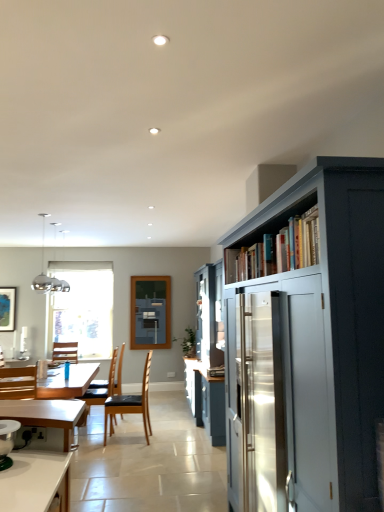
Describe the element at coordinates (276, 245) in the screenshot. This screenshot has height=512, width=384. I see `white painted wood bookshelf at upper right` at that location.

This screenshot has height=512, width=384. What do you see at coordinates (101, 387) in the screenshot?
I see `brown leather chair at lower left, which is the 2th chair from right to left` at bounding box center [101, 387].

Describe the element at coordinates (65, 352) in the screenshot. I see `wooden chair at left, the first chair in the back-to-front sequence` at that location.

Describe the element at coordinates (307, 342) in the screenshot. The width and height of the screenshot is (384, 512). I see `matte gray cupboard at right` at that location.

At what (x,y) coordinates should I click in order to perform the action: click on white painted wood bookshelf at upper right. Please return your answer as a coordinate pair (x, y). Looking at the image, I should click on (276, 245).

From the picture: Is matte black picture frame at left further to camera compared to brown leather chair at lower left, marked as the 2th chair in a back-to-front arrangement?

Yes, matte black picture frame at left is behind brown leather chair at lower left, marked as the 2th chair in a back-to-front arrangement.

Consider the image. Visually, is matte black picture frame at left positioned to the left or to the right of brown leather chair at lower left, the third chair when ordered from left to right?

matte black picture frame at left is positioned on brown leather chair at lower left, the third chair when ordered from left to right,'s left side.

Does matte black picture frame at left have a smaller size compared to brown leather chair at lower left, marked as the 2th chair in a back-to-front arrangement?

Indeed, matte black picture frame at left has a smaller size compared to brown leather chair at lower left, marked as the 2th chair in a back-to-front arrangement.

How far apart are matte black picture frame at left and brown leather chair at lower left, which is counted as the 3th chair, starting from the front?

A distance of 2.18 meters exists between matte black picture frame at left and brown leather chair at lower left, which is counted as the 3th chair, starting from the front.

Is point (51, 287) positioned before point (85, 413)?

No, it is behind (85, 413).

From a real-world perspective, is metallic glass pendant lights at upper left physically below brown leather chair at lower left, the third chair when ordered from left to right?

No, from a real-world perspective, metallic glass pendant lights at upper left is not beneath brown leather chair at lower left, the third chair when ordered from left to right.

From the image's perspective, is blue fabric at center over matte gray cupboard at right?

No, from the image's perspective, blue fabric at center is not above matte gray cupboard at right.

Is blue fabric at center not close to matte gray cupboard at right?

blue fabric at center is far away from matte gray cupboard at right.

Looking at this image, between blue fabric at center and matte gray cupboard at right, which one has less height?

Standing shorter between the two is blue fabric at center.

How many degrees apart are the facing directions of blue fabric at center and matte gray cupboard at right?

The facing directions of blue fabric at center and matte gray cupboard at right are 88.8 degrees apart.

Considering the sizes of objects white painted wood bookshelf at upper right and wooden chair at left, the first chair in the back-to-front sequence, in the image provided, who is wider, white painted wood bookshelf at upper right or wooden chair at left, the first chair in the back-to-front sequence,?

With larger width is wooden chair at left, the first chair in the back-to-front sequence.

Would you say white painted wood bookshelf at upper right is outside wooden chair at left, the first chair when ordered from left to right?

white painted wood bookshelf at upper right is positioned outside wooden chair at left, the first chair when ordered from left to right.

Is white painted wood bookshelf at upper right further to the viewer compared to wooden chair at left, the first chair in the back-to-front sequence?

No.

Which of these two, wooden chair at lower left, which is the third chair from right to left, or black leather chair at center, the 2th chair from the front, stands shorter?

Standing shorter between the two is wooden chair at lower left, which is the third chair from right to left.

From the picture: Considering the relative positions of wooden chair at lower left, which is the third chair from right to left, and black leather chair at center, arranged as the 3th chair when viewed from the back, in the image provided, is wooden chair at lower left, which is the third chair from right to left, to the right of black leather chair at center, arranged as the 3th chair when viewed from the back, from the viewer's perspective?

No.

Consider the image. Is wooden chair at lower left, positioned as the 4th chair in back-to-front order, inside the boundaries of black leather chair at center, the 2th chair from the front, or outside?

wooden chair at lower left, positioned as the 4th chair in back-to-front order, is located beyond the bounds of black leather chair at center, the 2th chair from the front.

Which of these two, wooden chair at lower left, which ranks as the first chair in front-to-back order, or black leather chair at center, positioned as the 1th chair in right-to-left order, is bigger?

black leather chair at center, positioned as the 1th chair in right-to-left order, is bigger.

Could you measure the distance between wooden chair at lower left, positioned as the 4th chair in back-to-front order, and wooden chair at left, arranged as the 4th chair when viewed from the right?

They are 8.82 feet apart.

From the image's perspective, is wooden chair at lower left, which ranks as the first chair in front-to-back order, positioned above or below wooden chair at left, the first chair in the back-to-front sequence?

Clearly, from the image's perspective, wooden chair at lower left, which ranks as the first chair in front-to-back order, is above wooden chair at left, the first chair in the back-to-front sequence.

Who is taller, wooden chair at lower left, which is counted as the 2th chair, starting from the left, or wooden chair at left, the first chair when ordered from left to right?

wooden chair at lower left, which is counted as the 2th chair, starting from the left.

Can you confirm if wooden chair at lower left, positioned as the 4th chair in back-to-front order, is wider than wooden chair at left, arranged as the 4th chair when viewed from the right?

Correct, the width of wooden chair at lower left, positioned as the 4th chair in back-to-front order, exceeds that of wooden chair at left, arranged as the 4th chair when viewed from the right.

Can we say blue fabric at center lies outside metallic glass pendant lights at upper left?

That's correct, blue fabric at center is outside of metallic glass pendant lights at upper left.

Considering the relative sizes of blue fabric at center and metallic glass pendant lights at upper left in the image provided, is blue fabric at center wider than metallic glass pendant lights at upper left?

In fact, blue fabric at center might be narrower than metallic glass pendant lights at upper left.

From the image's perspective, is blue fabric at center positioned above or below metallic glass pendant lights at upper left?

blue fabric at center is situated lower than metallic glass pendant lights at upper left in the image.

From a real-world perspective, is blue fabric at center physically below metallic glass pendant lights at upper left?

Yes, from a real-world perspective, blue fabric at center is beneath metallic glass pendant lights at upper left.

Where is `picture frame located on the left of brown leather chair at lower left, the third chair when ordered from left to right`? picture frame located on the left of brown leather chair at lower left, the third chair when ordered from left to right is located at coordinates (7, 309).

Where is `chair that is the 2nd object to the right of the metallic glass pendant lights at upper left, starting at the anchor`? chair that is the 2nd object to the right of the metallic glass pendant lights at upper left, starting at the anchor is located at coordinates (101, 387).

Based on their spatial positions, is brown leather chair at lower left, which is counted as the 3th chair, starting from the front, or clear glass window at center closer to white painted wood bookshelf at upper right?

brown leather chair at lower left, which is counted as the 3th chair, starting from the front, is closer to white painted wood bookshelf at upper right.

Consider the image. Looking at the image, which one is located closer to metallic glass pendant lights at upper left, wooden chair at lower left, which is counted as the 2th chair, starting from the left, or black leather chair at center, arranged as the 3th chair when viewed from the back?

black leather chair at center, arranged as the 3th chair when viewed from the back.

Based on their spatial positions, is wooden chair at lower left, which is the third chair from right to left, or blue fabric at center closer to matte black picture frame at left?

Among the two, blue fabric at center is located nearer to matte black picture frame at left.

From the image, which object appears to be farther from black leather chair at center, positioned as the 1th chair in right-to-left order, matte gray cupboard at right or brown leather chair at lower left, the third chair when ordered from left to right?

matte gray cupboard at right.

Looking at the image, which one is located closer to wooden chair at left, arranged as the 4th chair when viewed from the right, matte gray cupboard at right or blue fabric at center?

blue fabric at center lies closer to wooden chair at left, arranged as the 4th chair when viewed from the right, than the other object.

Which object lies nearer to the anchor point brown leather chair at lower left, marked as the 2th chair in a back-to-front arrangement, wooden chair at lower left, which ranks as the first chair in front-to-back order, or wooden chair at left, which appears as the fourth chair when viewed from the front?

Based on the image, wooden chair at lower left, which ranks as the first chair in front-to-back order, appears to be nearer to brown leather chair at lower left, marked as the 2th chair in a back-to-front arrangement.

Looking at the image, which one is located closer to brown leather chair at lower left, which is counted as the 3th chair, starting from the front, clear glass window at center or black leather chair at center, arranged as the 3th chair when viewed from the back?

black leather chair at center, arranged as the 3th chair when viewed from the back, lies closer to brown leather chair at lower left, which is counted as the 3th chair, starting from the front, than the other object.

Based on their spatial positions, is black leather chair at center, positioned as the 1th chair in right-to-left order, or blue fabric at center further from matte gray cupboard at right?

Among the two, blue fabric at center is located further to matte gray cupboard at right.

Locate an element on the screen. window screen positioned between wooden chair at left, which appears as the fourth chair when viewed from the front, and clear glass window at center from near to far is located at coordinates (150, 312).

Locate an element on the screen. The height and width of the screenshot is (512, 384). picture frame between brown leather chair at lower left, marked as the 2th chair in a back-to-front arrangement, and blue fabric at center, along the z-axis is located at coordinates (7, 309).

The image size is (384, 512). Find the location of `picture frame between brown leather chair at lower left, the third chair when ordered from left to right, and clear glass window at center, along the z-axis`. picture frame between brown leather chair at lower left, the third chair when ordered from left to right, and clear glass window at center, along the z-axis is located at coordinates (7, 309).

At what (x,y) coordinates should I click in order to perform the action: click on light fixture positioned between matte gray cupboard at right and blue fabric at center from near to far. Please return your answer as a coordinate pair (x, y). The image size is (384, 512). Looking at the image, I should click on (46, 275).